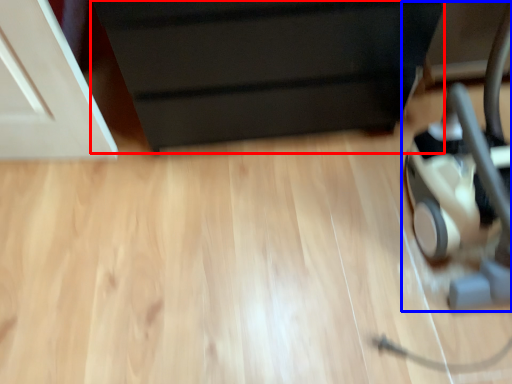
Question: Which of the following is the closest to the observer, furniture (highlighted by a red box) or baby carriage (highlighted by a blue box)?

Choices:
 (A) furniture
 (B) baby carriage

Answer: (B)